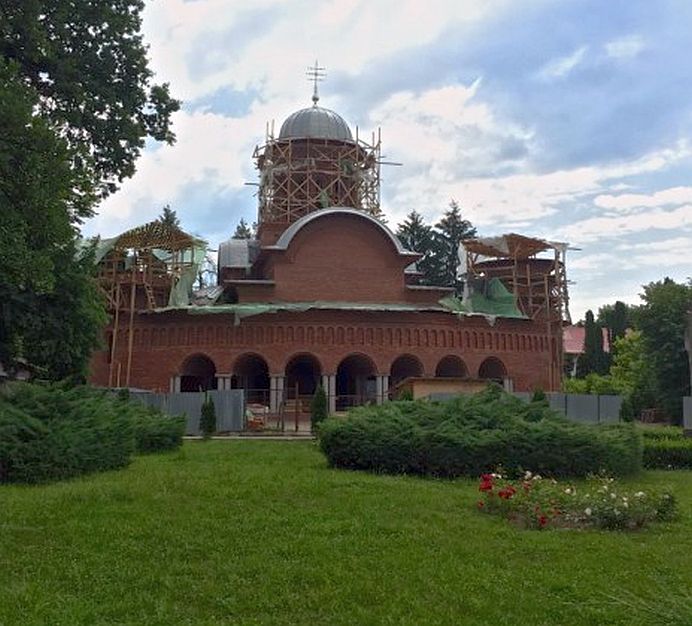
Locate an element on the screen. The width and height of the screenshot is (692, 626). concrete wall is located at coordinates (616, 411), (582, 406), (226, 404), (182, 407), (151, 399).